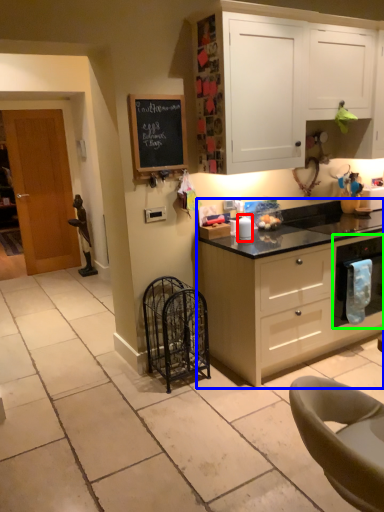
Question: Which object is the farthest from appliance (highlighted by a red box)? Choose among these: cabinetry (highlighted by a blue box) or kitchen appliance (highlighted by a green box).

Choices:
 (A) cabinetry
 (B) kitchen appliance

Answer: (B)